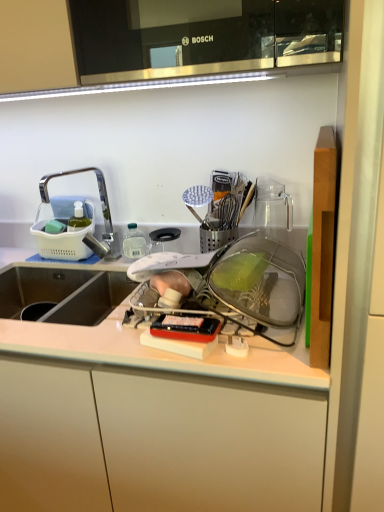
Question: Is white plastic tray at center taller or shorter than white matte cabinet at center?

Choices:
 (A) short
 (B) tall

Answer: (A)

Question: In the image, is white plastic tray at center positioned in front of or behind white matte cabinet at center?

Choices:
 (A) front
 (B) behind

Answer: (A)

Question: Which object is positioned farthest from the white matte cabinet at center?

Choices:
 (A) white plastic tray at center
 (B) brushed metal faucet at left

Answer: (B)

Question: Estimate the real-world distances between objects in this image. Which object is closer to the brushed metal faucet at left?

Choices:
 (A) white matte cabinet at center
 (B) white plastic tray at center

Answer: (B)